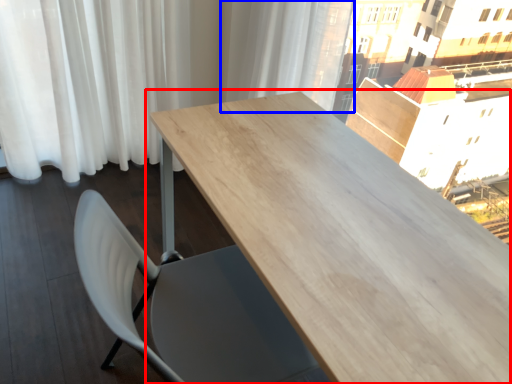
Question: Among these objects, which one is nearest to the camera, table (highlighted by a red box) or curtain (highlighted by a blue box)?

Choices:
 (A) table
 (B) curtain

Answer: (A)